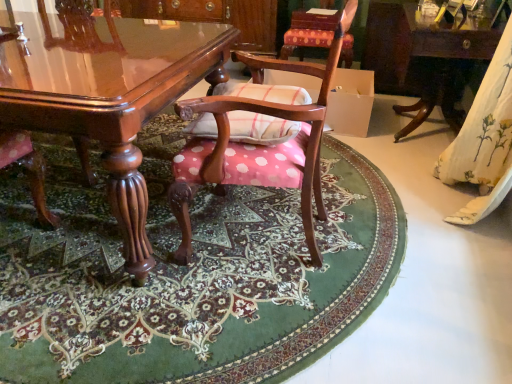
Question: Is polka dot fabric chair at center, acting as the 2th chair starting from the front, far away from white floral fabric at right?

Choices:
 (A) yes
 (B) no

Answer: (A)

Question: Can you confirm if polka dot fabric chair at center, which is counted as the 1th chair, starting from the back, is thinner than white floral fabric at right?

Choices:
 (A) yes
 (B) no

Answer: (B)

Question: Is polka dot fabric chair at center, acting as the 2th chair starting from the front, positioned beyond the bounds of white floral fabric at right?

Choices:
 (A) no
 (B) yes

Answer: (B)

Question: Can you confirm if polka dot fabric chair at center, acting as the 2th chair starting from the bottom, is taller than white floral fabric at right?

Choices:
 (A) no
 (B) yes

Answer: (A)

Question: Can you confirm if polka dot fabric chair at center, which is counted as the 1th chair, starting from the back, is shorter than white floral fabric at right?

Choices:
 (A) no
 (B) yes

Answer: (B)

Question: From the image's perspective, is polka dot fabric chair at center, acting as the 2th chair starting from the bottom, above white floral fabric at right?

Choices:
 (A) yes
 (B) no

Answer: (A)

Question: Is polka dot fabric chair at center, the first chair from the front, behind polka dot fabric chair at center, the first chair from the top?

Choices:
 (A) yes
 (B) no

Answer: (B)

Question: Is polka dot fabric chair at center, arranged as the 2th chair when viewed from the top, to the left of polka dot fabric chair at center, acting as the 2th chair starting from the front, from the viewer's perspective?

Choices:
 (A) no
 (B) yes

Answer: (B)

Question: Does polka dot fabric chair at center, the first chair from the front, appear on the right side of polka dot fabric chair at center, acting as the 2th chair starting from the bottom?

Choices:
 (A) no
 (B) yes

Answer: (A)

Question: Is polka dot fabric chair at center, the 1th chair ordered from the bottom, turned away from polka dot fabric chair at center, acting as the 2th chair starting from the bottom?

Choices:
 (A) no
 (B) yes

Answer: (A)

Question: From a real-world perspective, does polka dot fabric chair at center, arranged as the 2th chair when viewed from the top, stand above polka dot fabric chair at center, acting as the 2th chair starting from the front?

Choices:
 (A) no
 (B) yes

Answer: (B)

Question: Is polka dot fabric chair at center, which ranks as the second chair in back-to-front order, not within polka dot fabric chair at center, acting as the 2th chair starting from the front?

Choices:
 (A) yes
 (B) no

Answer: (A)

Question: Is polka dot fabric chair at center, the 1th chair ordered from the bottom, at the back of glossy wood table at center, which is the 1th table from left to right?

Choices:
 (A) no
 (B) yes

Answer: (A)